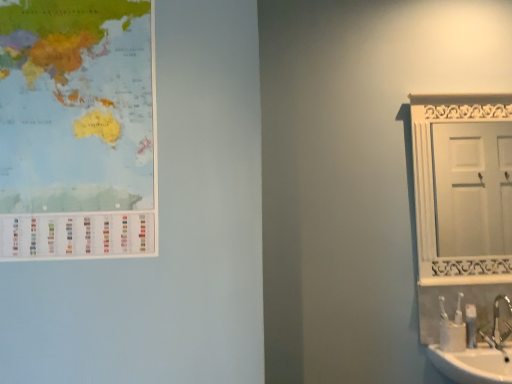
Question: Could you tell me if white plastic toothbrush at lower right is facing white wooden door at right?

Choices:
 (A) no
 (B) yes

Answer: (A)

Question: Is white wooden door at right inside white plastic toothbrush at lower right?

Choices:
 (A) yes
 (B) no

Answer: (B)

Question: Is the position of white plastic toothbrush at lower right less distant than that of white wooden door at right?

Choices:
 (A) yes
 (B) no

Answer: (A)

Question: Does white plastic toothbrush at lower right have a lesser width compared to white wooden door at right?

Choices:
 (A) no
 (B) yes

Answer: (A)

Question: Can you confirm if white plastic toothbrush at lower right is positioned to the right of white wooden door at right?

Choices:
 (A) no
 (B) yes

Answer: (A)

Question: Is matte paper map at upper left situated inside white plastic toothbrush at lower right or outside?

Choices:
 (A) outside
 (B) inside

Answer: (A)

Question: Considering the positions of point click(x=96, y=210) and point click(x=475, y=319), is point click(x=96, y=210) closer or farther from the camera than point click(x=475, y=319)?

Choices:
 (A) closer
 (B) farther

Answer: (A)

Question: From the image's perspective, is matte paper map at upper left located above or below white plastic toothbrush at lower right?

Choices:
 (A) below
 (B) above

Answer: (B)

Question: From a real-world perspective, is matte paper map at upper left physically located above or below white plastic toothbrush at lower right?

Choices:
 (A) below
 (B) above

Answer: (B)

Question: In terms of size, does white wooden door at right appear bigger or smaller than matte paper map at upper left?

Choices:
 (A) big
 (B) small

Answer: (A)

Question: In terms of height, does white wooden door at right look taller or shorter compared to matte paper map at upper left?

Choices:
 (A) tall
 (B) short

Answer: (B)

Question: Choose the correct answer: Is white wooden door at right inside matte paper map at upper left or outside it?

Choices:
 (A) inside
 (B) outside

Answer: (B)

Question: Looking at their shapes, would you say white wooden door at right is wider or thinner than matte paper map at upper left?

Choices:
 (A) thin
 (B) wide

Answer: (B)

Question: From the image's perspective, is white plastic toothbrush at lower right positioned above or below silver metallic faucet at lower right?

Choices:
 (A) above
 (B) below

Answer: (B)

Question: Is white plastic toothbrush at lower right bigger or smaller than silver metallic faucet at lower right?

Choices:
 (A) big
 (B) small

Answer: (B)